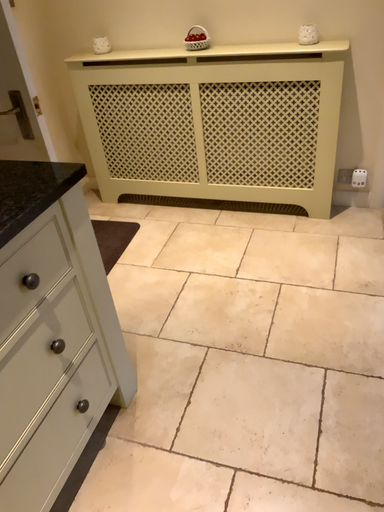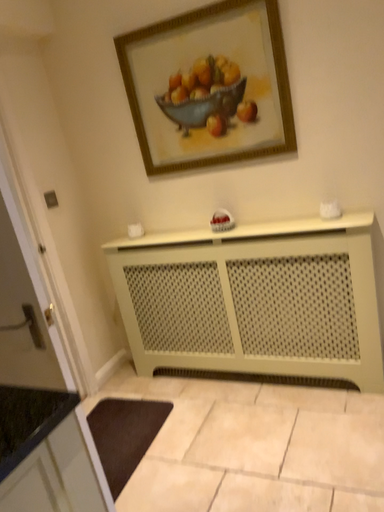
Question: How did the camera likely rotate when shooting the video?

Choices:
 (A) rotated right
 (B) rotated left

Answer: (B)